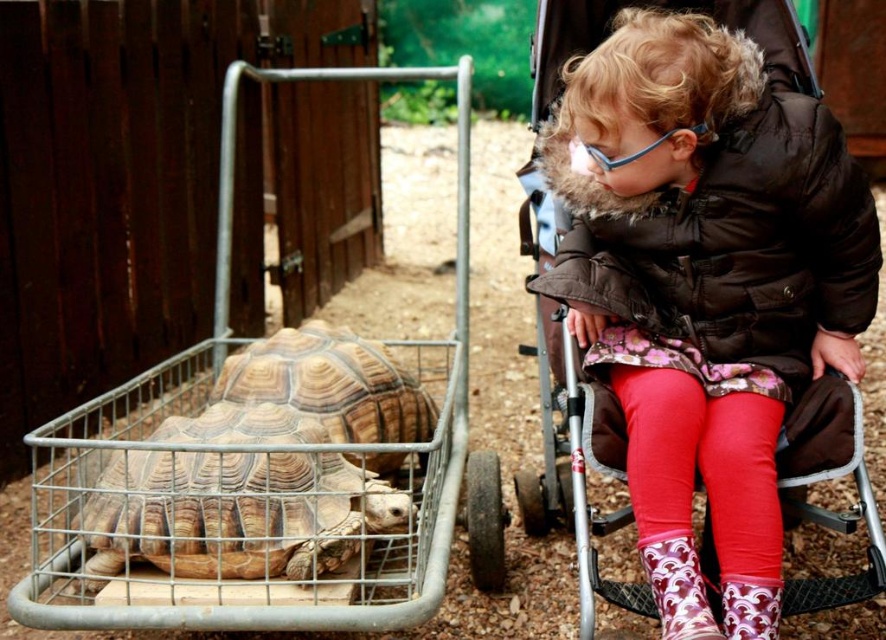
Question: Does brown textured shell at center appear under brown textured tortoise at left?

Choices:
 (A) yes
 (B) no

Answer: (A)

Question: Estimate the real-world distances between objects in this image. Which object is farther from the brown textured shell at center?

Choices:
 (A) brown textured tortoise at left
 (B) printed fabric boot at lower right

Answer: (B)

Question: Based on their relative distances, which object is farther from the printed fabric boot at lower right?

Choices:
 (A) fluffy brown coat at upper right
 (B) brown textured tortoise at left

Answer: (B)

Question: Does fluffy brown coat at upper right have a lesser width compared to printed fabric boot at lower right?

Choices:
 (A) yes
 (B) no

Answer: (B)

Question: Which object is positioned farthest from the brown textured tortoise at left?

Choices:
 (A) fluffy brown coat at upper right
 (B) printed fabric boot at lower right

Answer: (B)

Question: Does fluffy brown coat at upper right appear under brown textured shell at center?

Choices:
 (A) yes
 (B) no

Answer: (B)